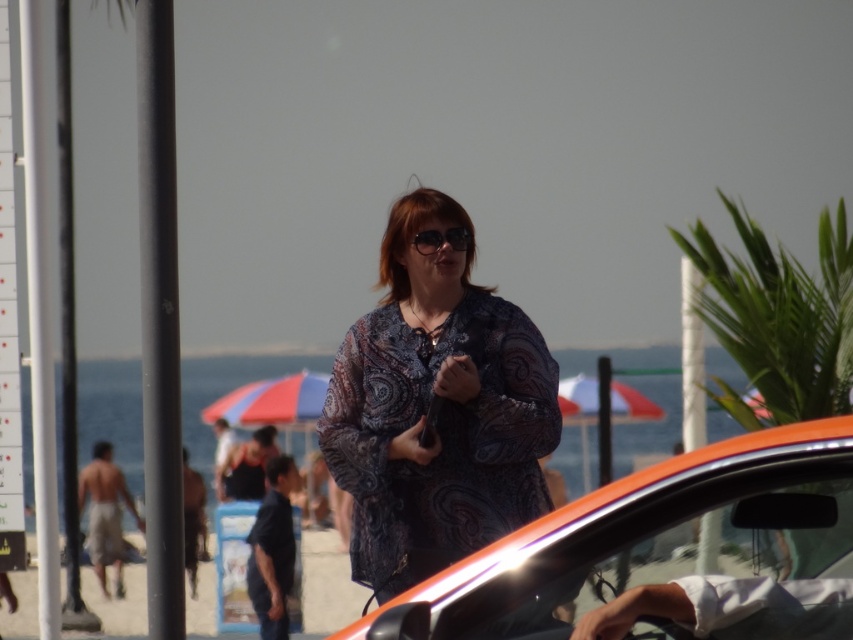
Does beige cotton shorts at lower left appear over matte black sunglasses at center?

Actually, beige cotton shorts at lower left is below matte black sunglasses at center.

Image resolution: width=853 pixels, height=640 pixels. What do you see at coordinates (105, 515) in the screenshot?
I see `beige cotton shorts at lower left` at bounding box center [105, 515].

At what (x,y) coordinates should I click in order to perform the action: click on beige cotton shorts at lower left. Please return your answer as a coordinate pair (x, y). Looking at the image, I should click on (105, 515).

Which is below, patterned fabric blouse at center or green leafy palm tree at upper right?

patterned fabric blouse at center is below.

Who is more forward, (509, 424) or (775, 417)?

Point (509, 424) is in front.

This screenshot has width=853, height=640. Find the location of `patterned fabric blouse at center`. patterned fabric blouse at center is located at coordinates (438, 410).

Is green leafy palm tree at upper right positioned at the back of beige cotton shorts at lower left?

No.

Measure the distance between point (729, 349) and camera.

The distance of point (729, 349) from camera is 16.22 meters.

Locate an element on the screen. This screenshot has height=640, width=853. green leafy palm tree at upper right is located at coordinates (778, 317).